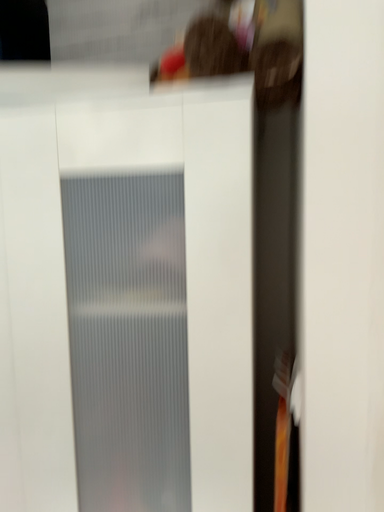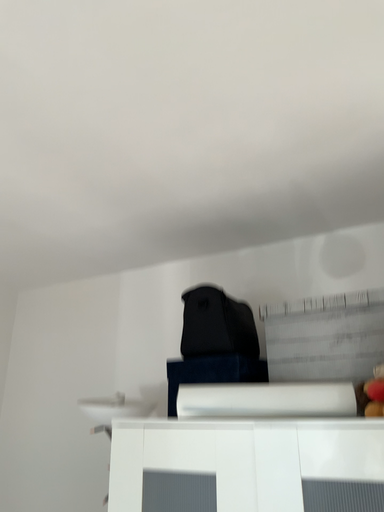
Question: How did the camera likely rotate when shooting the video?

Choices:
 (A) rotated right
 (B) rotated left

Answer: (B)